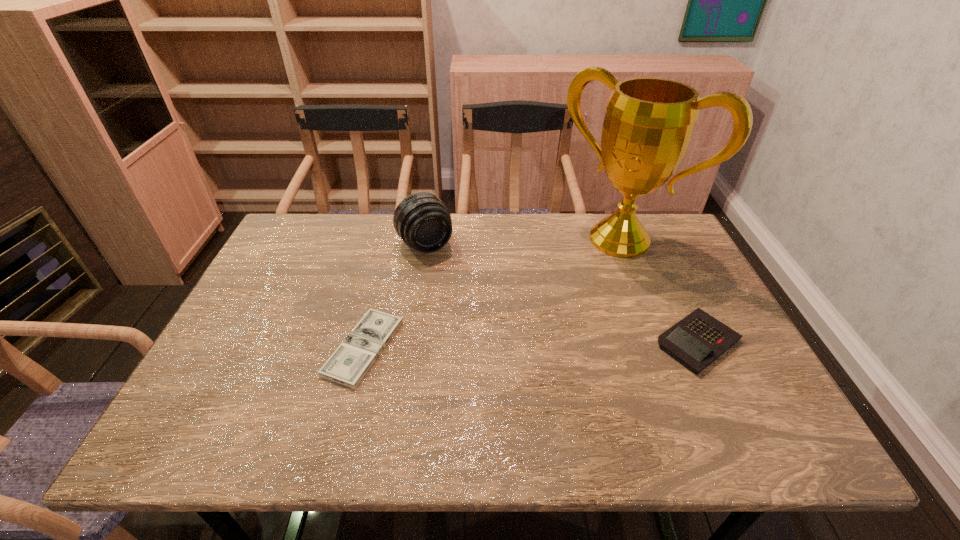
Where is `vacant space located 0.210m at the front element of the third shortest object`? vacant space located 0.210m at the front element of the third shortest object is located at coordinates (467, 305).

The height and width of the screenshot is (540, 960). What are the coordinates of `vacant region located at the front element of the third shortest object` in the screenshot? It's located at (473, 315).

You are a GUI agent. You are given a task and a screenshot of the screen. Output one action in this format:
    pyautogui.click(x=<x>, y=<y>)
    Task: Click on the award located in the far edge section of the desktop
    
    Given the screenshot: What is the action you would take?
    (649, 122)

Find the location of a particular element. telephoto lens positioned at the far edge is located at coordinates (422, 220).

I want to click on dollar that is at the near edge, so click(x=349, y=363).

In order to click on calculator that is at the near edge in this screenshot , I will do `click(697, 340)`.

Identify the location of calculator that is positioned at the right edge. (697, 340).

Image resolution: width=960 pixels, height=540 pixels. I want to click on award that is positioned at the right edge, so click(x=649, y=122).

Locate an element on the screen. The height and width of the screenshot is (540, 960). object that is at the far right corner is located at coordinates (649, 122).

Image resolution: width=960 pixels, height=540 pixels. Find the location of `object present at the near right corner`. object present at the near right corner is located at coordinates (697, 340).